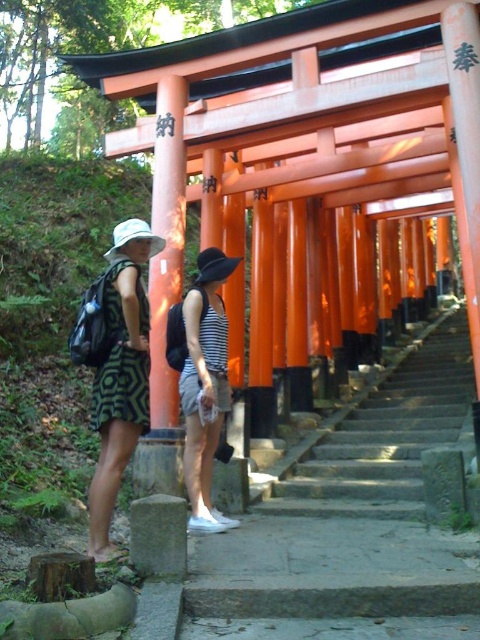
Question: Based on their relative distances, which object is farther from the striped cotton tank top at center?

Choices:
 (A) green patterned dress at left
 (B) smooth stone stairs at center

Answer: (B)

Question: Can you confirm if stone stairs at center is wider than striped cotton tank top at center?

Choices:
 (A) yes
 (B) no

Answer: (A)

Question: Is green patterned dress at left to the left of striped cotton tank top at center from the viewer's perspective?

Choices:
 (A) yes
 (B) no

Answer: (A)

Question: Is stone stairs at center closer to the viewer compared to striped cotton tank top at center?

Choices:
 (A) yes
 (B) no

Answer: (B)

Question: Which point is farther to the camera?

Choices:
 (A) [201, 449]
 (B) [414, 540]
 (C) [439, 348]

Answer: (C)

Question: Which object is farther from the camera taking this photo?

Choices:
 (A) smooth stone stairs at center
 (B) striped cotton tank top at center
 (C) stone stairs at center

Answer: (C)